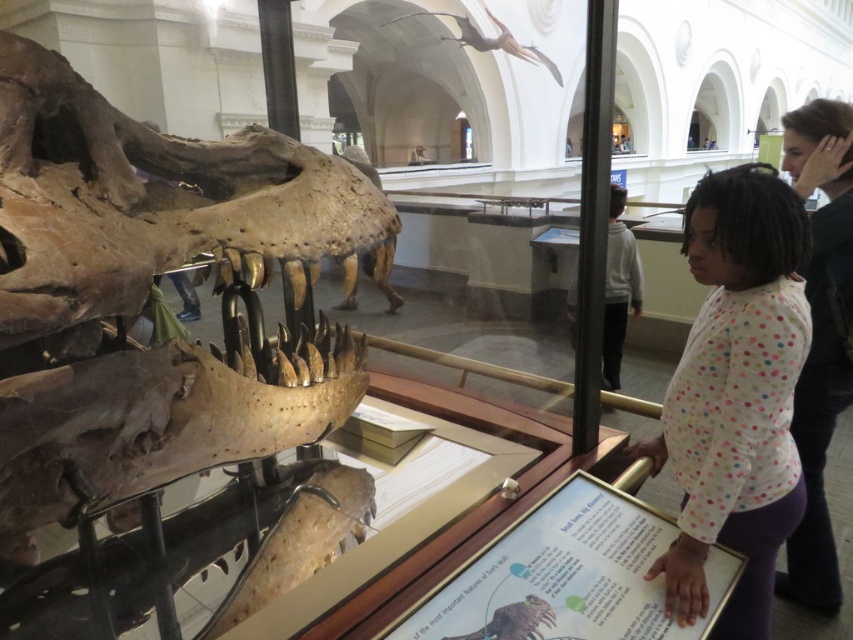
You are a visitor in the museum and want to take a photo of the informational plaque below the dinosaur skull exhibit. You notice a person wearing a white polka dot shirt at center and another with matte black hair at upper right blocking your view. Which of the two is shorter and can you ask to step aside?

The white polka dot shirt at center is shorter than the matte black hair at upper right. You can ask the person wearing the white polka dot shirt at center to step aside since they are shorter and closer to your eye level.

You are a museum visitor standing in front of the brown rough skull at center. You want to take a photo of it with your phone, which has a minimum focus distance of 1 meter. Will your phone be able to focus on the skull?

The brown rough skull at center is 1.32 meters away from the camera. Since your phone requires a minimum focus distance of 1 meter, it can focus on the skull as the distance is greater than the required minimum.

You are a museum visitor standing in front of the dinosaur skull exhibit. You notice the brown rough skull at center and the white polka dot shirt at center. Which object is bigger in size?

The brown rough skull at center is larger in size compared to the white polka dot shirt at center.